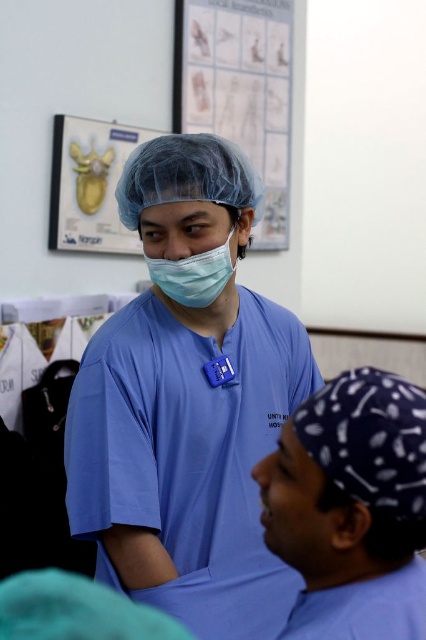
Between white paper poster at upper center and matte blue mask at center, which one appears on the left side from the viewer's perspective?

matte blue mask at center

Is white paper poster at upper center to the right of matte blue mask at center from the viewer's perspective?

Yes, white paper poster at upper center is to the right of matte blue mask at center.

Does point (247, 83) lie in front of point (180, 289)?

No, it is behind (180, 289).

Find the location of `white paper poster at upper center`. white paper poster at upper center is located at coordinates (241, 92).

What do you see at coordinates (187, 401) in the screenshot? I see `matte blue scrubs at center` at bounding box center [187, 401].

Is matte blue scrubs at center above matte blue mask at center?

Incorrect, matte blue scrubs at center is not positioned above matte blue mask at center.

Find the location of `matte blue scrubs at center`. matte blue scrubs at center is located at coordinates (187, 401).

This screenshot has height=640, width=426. I want to click on matte blue scrubs at center, so click(x=187, y=401).

Between point (213, 586) and point (207, 80), which one is positioned behind?

The point (207, 80) is behind.

Is matte blue scrubs at center smaller than white paper poster at upper center?

Correct, matte blue scrubs at center occupies less space than white paper poster at upper center.

Identify the location of matte blue scrubs at center. (187, 401).